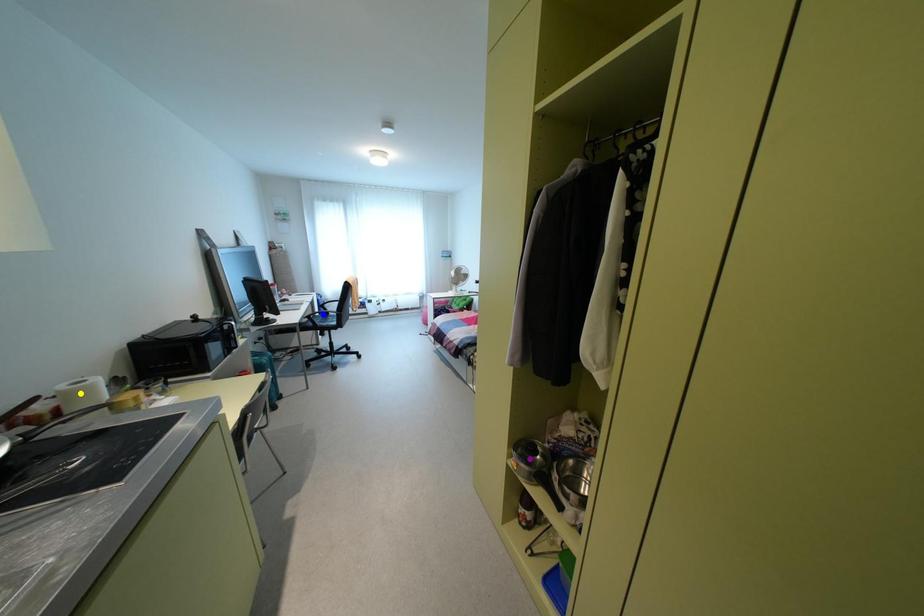
Order these from farthest to nearest:
yellow point
blue point
purple point

blue point
purple point
yellow point